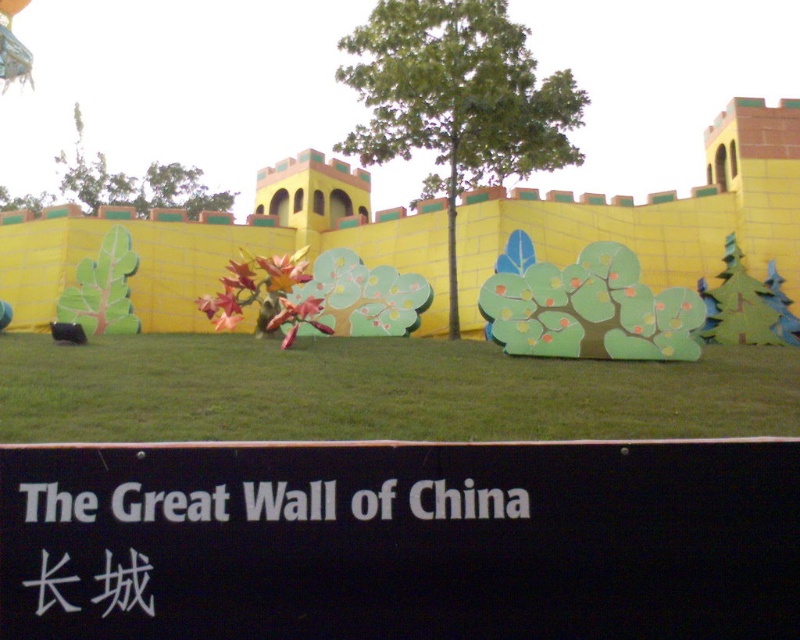
You are a tourist standing at the base of the Great Wall and see both the black plastic sign at lower center and the white plastic sign at center. Which sign is bigger?

The black plastic sign at lower center is larger than the white plastic sign at center.

You are standing at the base of the Great Wall of China in the image. You want to place a small decorative flag exactly at the center of the green grass at center. According to the coordinates provided, what are the coordinates where you should place the flag?

The coordinates for the green grass at center are at point (x=377, y=392), so you should place the flag at those coordinates.

You are standing at the entrance of the Great Wall scene and notice a black plastic sign at lower center. Where exactly is the black plastic sign positioned in relation to the vibrant yellow wall and the whimsical forest cutouts?

The black plastic sign at lower center is located at point coordinates of 0.845 on the x axis and 0.501 on the y axis.